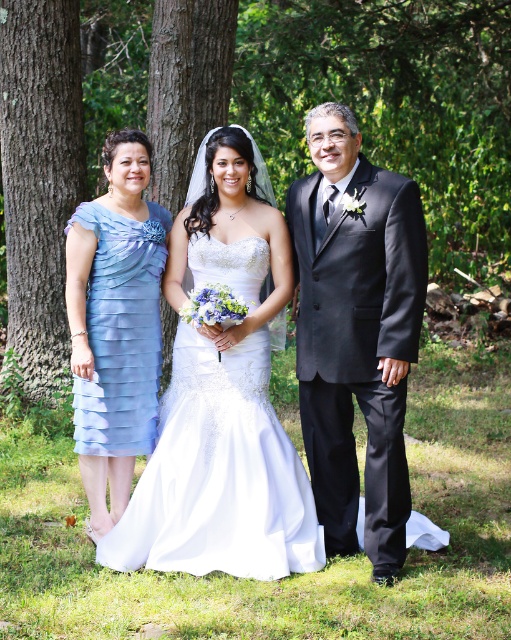
Question: Is green textured tree at center positioned in front of light blue chiffon dress at left?

Choices:
 (A) no
 (B) yes

Answer: (A)

Question: Among these points, which one is farthest from the camera?

Choices:
 (A) (201, 268)
 (B) (132, 316)
 (C) (95, 19)
 (D) (58, 212)

Answer: (C)

Question: Does green textured tree at center lie in front of light blue chiffon dress at left?

Choices:
 (A) yes
 (B) no

Answer: (B)

Question: In this image, where is green textured tree at center located relative to white satin dress at center?

Choices:
 (A) above
 (B) below

Answer: (A)

Question: Which point is closer to the camera?

Choices:
 (A) (499, 61)
 (B) (26, 209)
 (C) (99, 371)

Answer: (C)

Question: Which of the following is the farthest from the observer?

Choices:
 (A) black satin suit at right
 (B) white satin dress at center

Answer: (B)